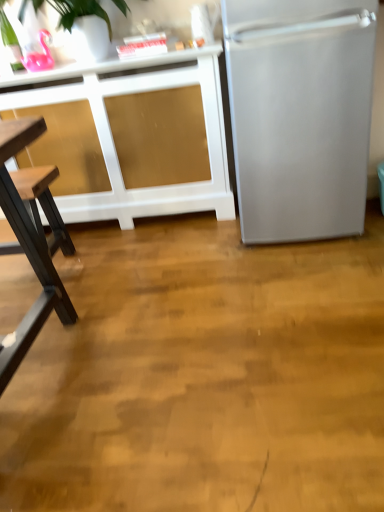
Question: Visually, is satin silver refrigerator at right positioned to the left or to the right of white matte cabinet at upper left?

Choices:
 (A) left
 (B) right

Answer: (B)

Question: Is point (278, 226) closer or farther from the camera than point (170, 62)?

Choices:
 (A) closer
 (B) farther

Answer: (A)

Question: From the image's perspective, is satin silver refrigerator at right above or below white matte cabinet at upper left?

Choices:
 (A) below
 (B) above

Answer: (B)

Question: Is white matte cabinet at upper left spatially inside satin silver refrigerator at right, or outside of it?

Choices:
 (A) outside
 (B) inside

Answer: (A)

Question: Considering their positions, is white matte cabinet at upper left located in front of or behind satin silver refrigerator at right?

Choices:
 (A) behind
 (B) front

Answer: (A)

Question: Looking at their shapes, would you say white matte cabinet at upper left is wider or thinner than satin silver refrigerator at right?

Choices:
 (A) wide
 (B) thin

Answer: (B)

Question: From a real-world perspective, relative to satin silver refrigerator at right, is white matte cabinet at upper left vertically above or below?

Choices:
 (A) below
 (B) above

Answer: (A)